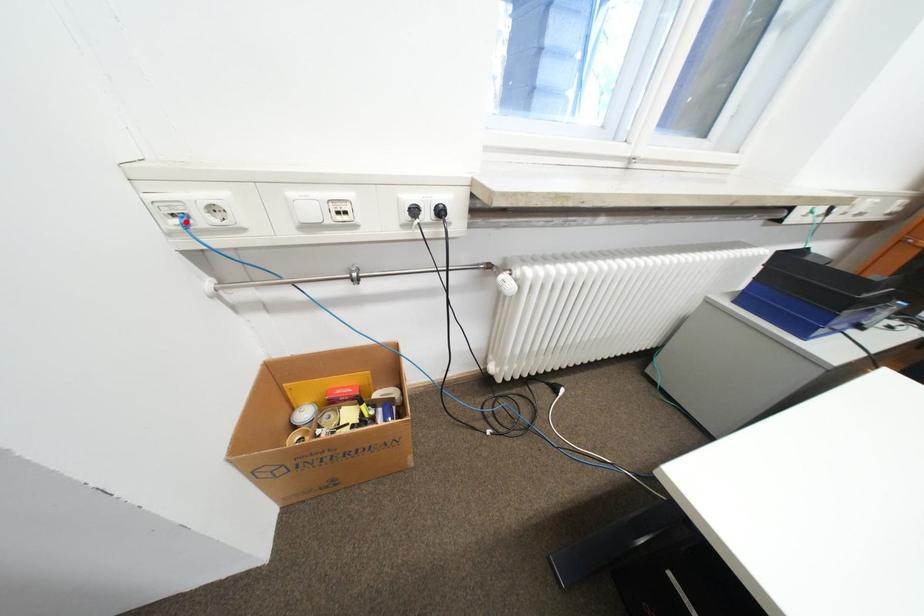
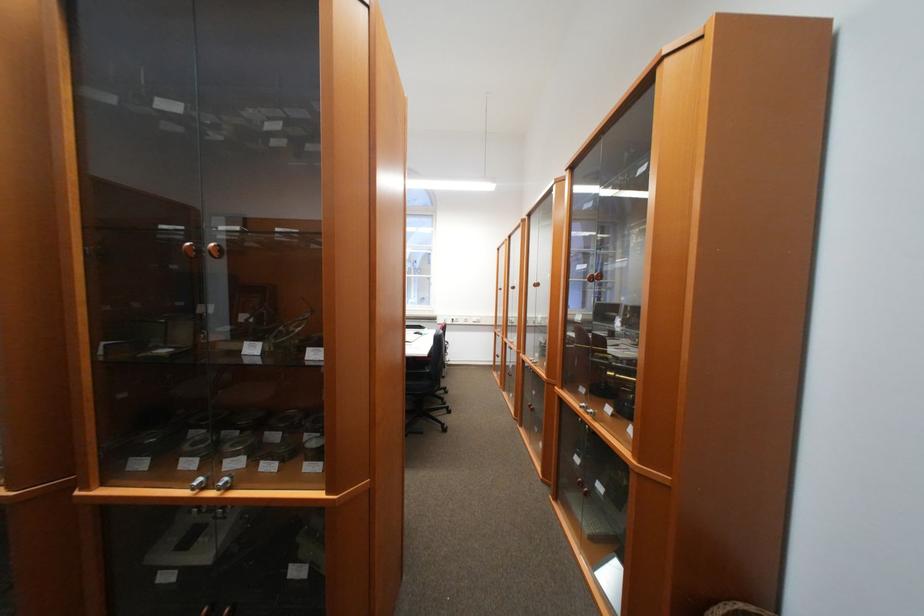
Question: I am providing you with two images of the same scene from different viewpoints. A red point is marked on the first image. Is the red point's position out of view in image 2?

Choices:
 (A) Yes
 (B) No

Answer: (A)